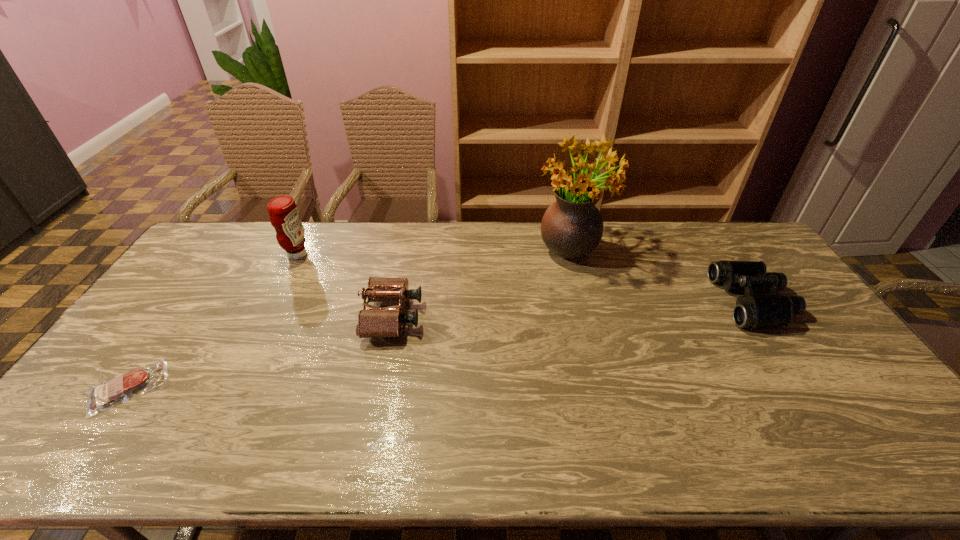
The height and width of the screenshot is (540, 960). Find the location of `vacant space at the near edge of the desktop`. vacant space at the near edge of the desktop is located at coordinates (232, 460).

Find the location of a particular element. Image resolution: width=960 pixels, height=540 pixels. free location at the left edge is located at coordinates (76, 425).

In the image, there is a desktop. Where is `vacant space at the right edge`? vacant space at the right edge is located at coordinates (790, 328).

Where is `free point at the far right corner`? The width and height of the screenshot is (960, 540). free point at the far right corner is located at coordinates (708, 230).

I want to click on free space at the near right corner of the desktop, so [894, 435].

Locate an element on the screen. The width and height of the screenshot is (960, 540). vacant space in between the fourth shortest object and the leftmost object is located at coordinates (213, 321).

Locate an element on the screen. unoccupied position between the leftmost object and the third object from left to right is located at coordinates (260, 352).

I want to click on empty space that is in between the fourth object from right to left and the rightmost object, so pos(525,278).

What are the coordinates of `free space that is in between the condiment and the steak` in the screenshot? It's located at (213, 321).

This screenshot has height=540, width=960. In order to click on free space between the flower arrangement and the third object from left to right in this screenshot , I will do `click(482, 282)`.